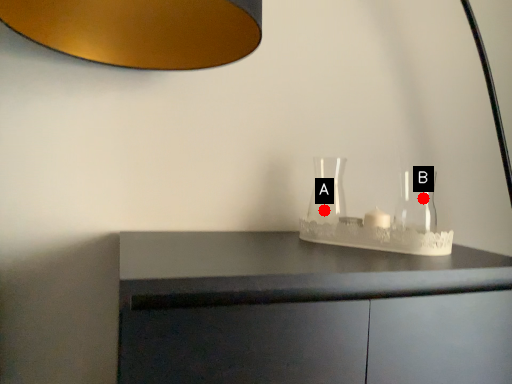
Question: Two points are circled on the image, labeled by A and B beside each circle. Which point is closer to the camera taking this photo?

Choices:
 (A) A is closer
 (B) B is closer

Answer: (B)